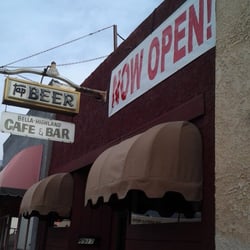
Where is `wall`? wall is located at coordinates (83, 148).